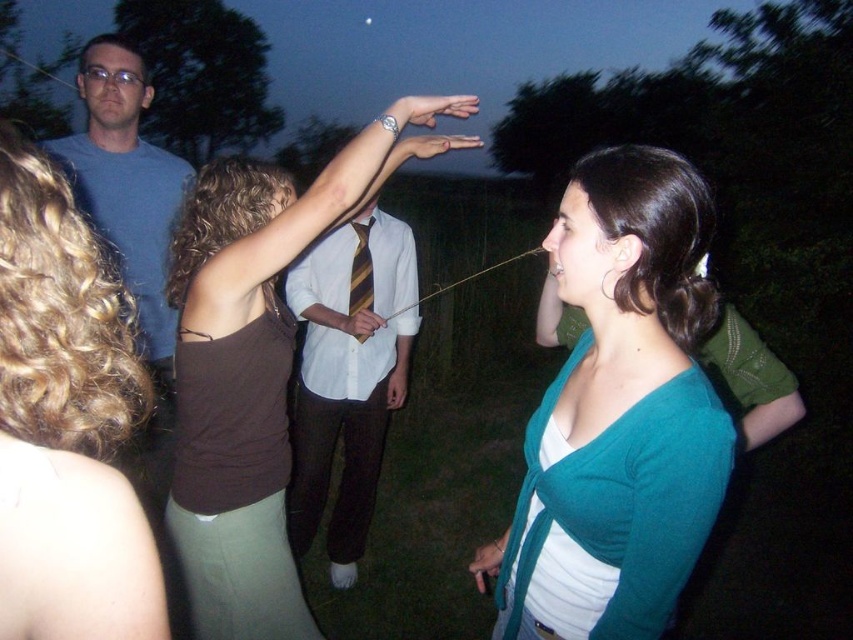
Question: Is teal knit cardigan at center behind brown fabric shirt at center?

Choices:
 (A) no
 (B) yes

Answer: (A)

Question: Which point appears closest to the camera in this image?

Choices:
 (A) (76, 225)
 (B) (300, 456)

Answer: (A)

Question: Among these points, which one is farthest from the camera?

Choices:
 (A) (364, 284)
 (B) (138, 589)
 (C) (234, 364)

Answer: (A)

Question: Can you confirm if teal knit cardigan at center is thinner than silky brown string at center?

Choices:
 (A) yes
 (B) no

Answer: (B)

Question: Which object is farther from the camera taking this photo?

Choices:
 (A) striped tie at center
 (B) yellow striped tie at center

Answer: (B)

Question: Does brown fabric shirt at center have a smaller size compared to silky brown string at center?

Choices:
 (A) yes
 (B) no

Answer: (B)